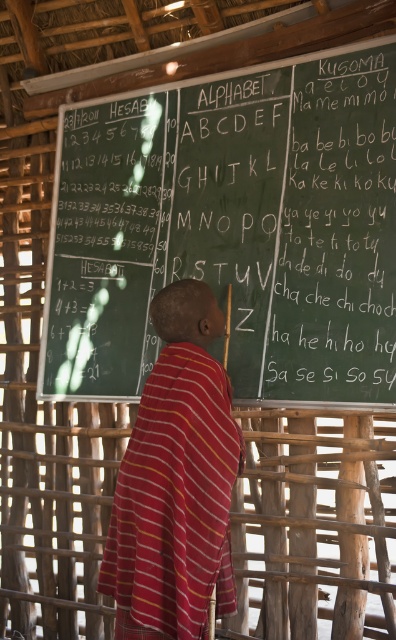
Is point (329, 310) positioned before point (188, 476)?

No, (329, 310) is further to viewer.

Between green chalkboard at upper center and striped cotton robe at center, which one is positioned lower?

Positioned lower is striped cotton robe at center.

Who is more forward, (329, 161) or (194, 426)?

Positioned in front is point (194, 426).

I want to click on green chalkboard at upper center, so click(x=232, y=227).